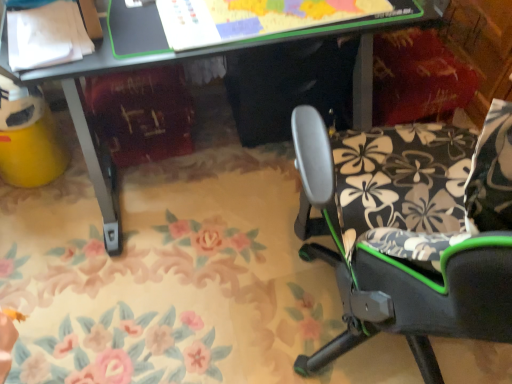
Locate an element on the screen. The width and height of the screenshot is (512, 384). free space in front of matte black desk at center is located at coordinates (161, 300).